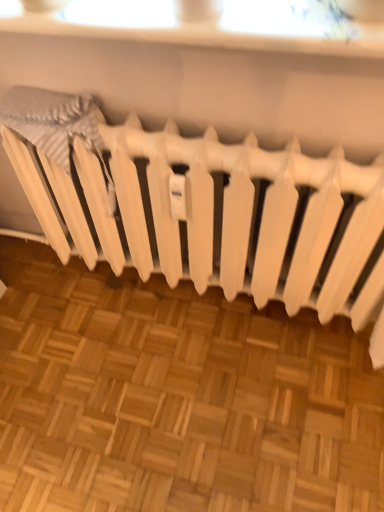
What do you see at coordinates (212, 213) in the screenshot? I see `white matte radiator at center` at bounding box center [212, 213].

This screenshot has height=512, width=384. What are the coordinates of `white matte radiator at center` in the screenshot? It's located at pyautogui.click(x=212, y=213).

Locate an element on the screen. The width and height of the screenshot is (384, 512). white matte radiator at center is located at coordinates (212, 213).